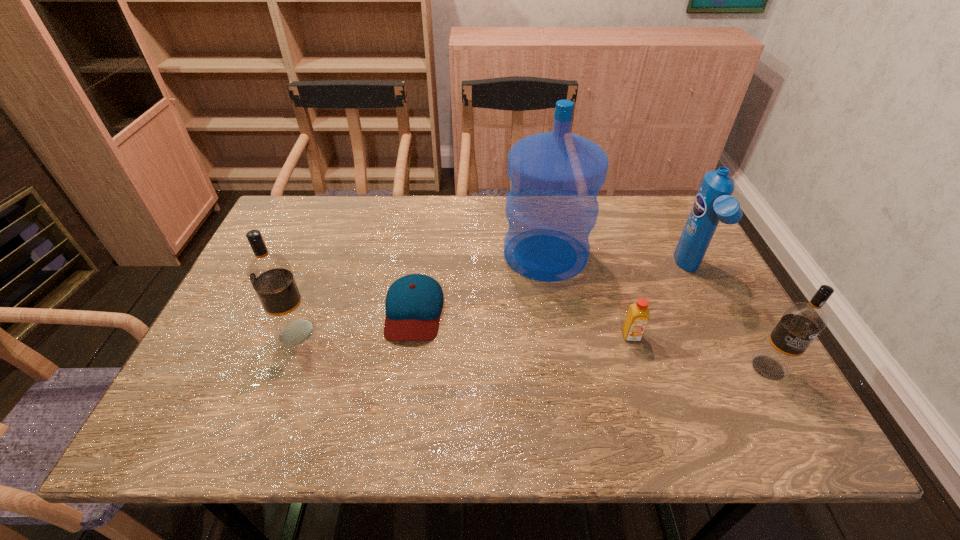
The width and height of the screenshot is (960, 540). What are the coordinates of `object that can be found as the second closest to the farther vodka` in the screenshot? It's located at (551, 208).

At what (x,y) coordinates should I click in order to perform the action: click on free spot that satisfies the following two spatial constraints: 1. with the bill of the baseball cap facing forward; 2. on the label of the farther vodka. Please return your answer as a coordinate pair (x, y). Looking at the image, I should click on (411, 333).

At what (x,y) coordinates should I click in order to perform the action: click on free space that satisfies the following two spatial constraints: 1. with the bill of the second object from left to right facing forward; 2. on the label of the farther vodka. Please return your answer as a coordinate pair (x, y). The width and height of the screenshot is (960, 540). Looking at the image, I should click on (411, 333).

What are the coordinates of `free spot that satisfies the following two spatial constraints: 1. with the bill of the baseball cap facing forward; 2. on the label of the left vodka` in the screenshot? It's located at (411, 333).

Image resolution: width=960 pixels, height=540 pixels. Find the location of `free spot that satisfies the following two spatial constraints: 1. on the front side of the shampoo; 2. on the label of the taller vodka`. free spot that satisfies the following two spatial constraints: 1. on the front side of the shampoo; 2. on the label of the taller vodka is located at coordinates (721, 333).